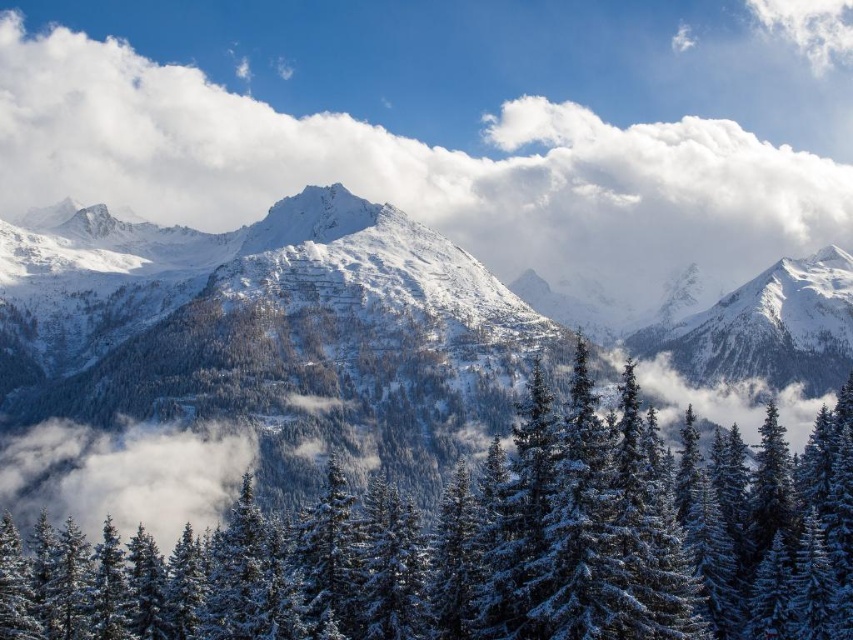
You are standing in the winter landscape scene looking at the mountains and the dense forest. There is a point marked at coordinates point (421, 164). What is this point located on?

The point (421, 164) is located on the white fluffy cloud at upper center.

You are standing in the winter landscape scene and want to walk from the point at coordinates point (633, 83) to the point at coordinates point (358, 204). Which direction should you move to get closer to your destination?

Since point (633, 83) is further to the camera than point (358, 204), you should move towards the direction of the mountains to get closer to point (358, 204).